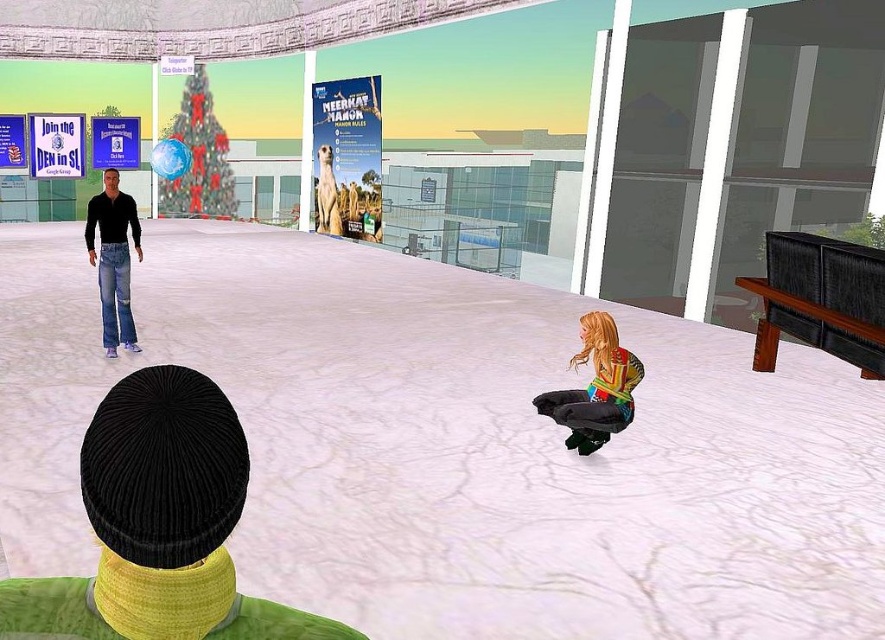
Which of these two, white textured ice at center or denim jeans at left, stands shorter?

With less height is denim jeans at left.

Does white textured ice at center appear under denim jeans at left?

Indeed, white textured ice at center is positioned under denim jeans at left.

Image resolution: width=885 pixels, height=640 pixels. Describe the element at coordinates (455, 445) in the screenshot. I see `white textured ice at center` at that location.

The width and height of the screenshot is (885, 640). I want to click on white textured ice at center, so click(455, 445).

Can you confirm if white matte floor at center is smaller than black corduroy beanie at center?

No, white matte floor at center is not smaller than black corduroy beanie at center.

Is white matte floor at center bigger than black corduroy beanie at center?

Correct, white matte floor at center is larger in size than black corduroy beanie at center.

Which is in front, point (616, 45) or point (85, 605)?

Point (85, 605) is more forward.

Locate an element on the screen. The height and width of the screenshot is (640, 885). white matte floor at center is located at coordinates (566, 132).

Does white matte floor at center lie behind multicolored fabric dress at lower right?

Yes, white matte floor at center is behind multicolored fabric dress at lower right.

Is white matte floor at center to the right of multicolored fabric dress at lower right from the viewer's perspective?

No, white matte floor at center is not to the right of multicolored fabric dress at lower right.

Where is `white matte floor at center`? This screenshot has width=885, height=640. white matte floor at center is located at coordinates (566, 132).